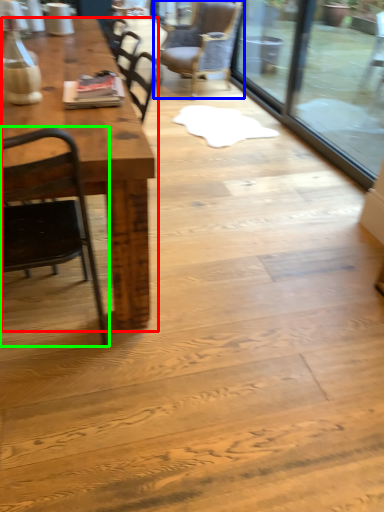
Question: Which object is positioned farthest from table (highlighted by a red box)? Select from chair (highlighted by a blue box) and chair (highlighted by a green box).

Choices:
 (A) chair
 (B) chair

Answer: (A)